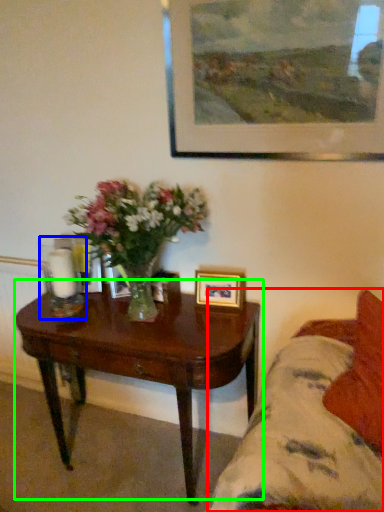
Question: Which object is positioned closest to studio couch (highlighted by a red box)? Select from candle holder (highlighted by a blue box) and coffee table (highlighted by a green box).

Choices:
 (A) candle holder
 (B) coffee table

Answer: (B)